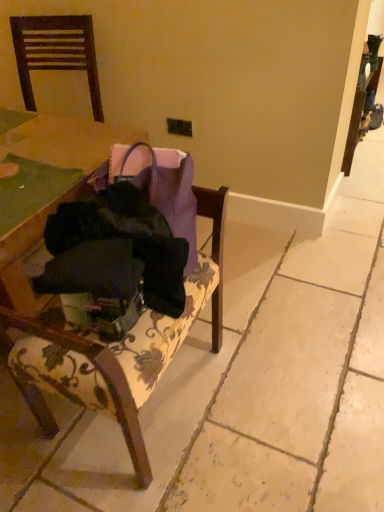
Image resolution: width=384 pixels, height=512 pixels. In order to click on vacant area to the right of velvet floral-patterned chair at center, the 1th chair from the bottom in this screenshot , I will do `click(276, 389)`.